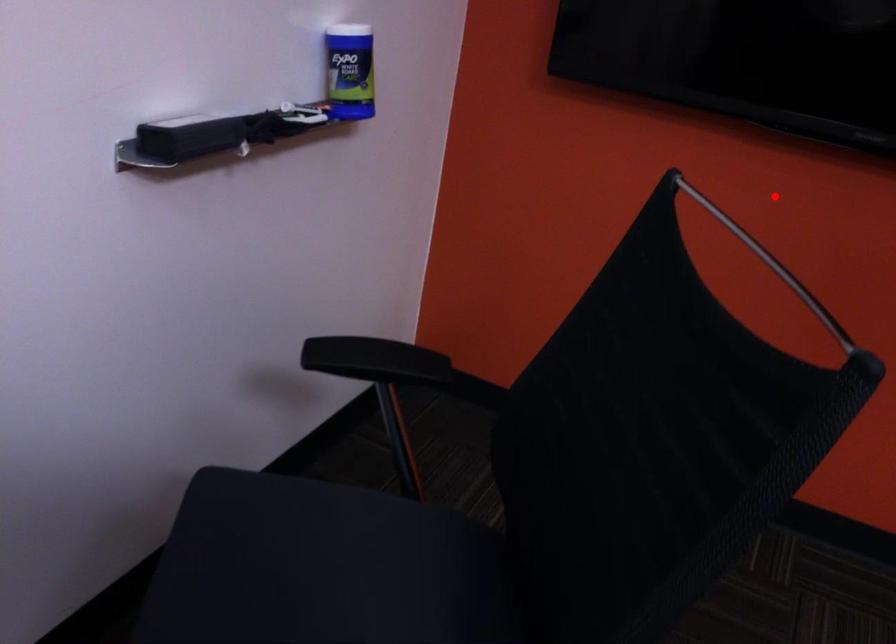
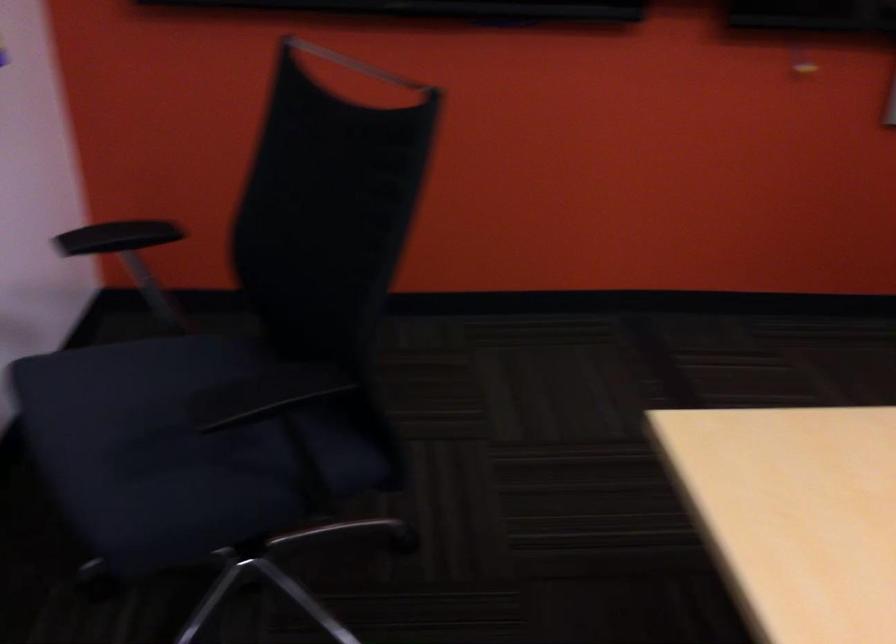
Question: I am providing you with two images of the same scene from different viewpoints. A red point is shown in image1. For the corresponding object point in image2, is it positioned nearer or farther from the camera?

Choices:
 (A) Nearer
 (B) Farther

Answer: (B)